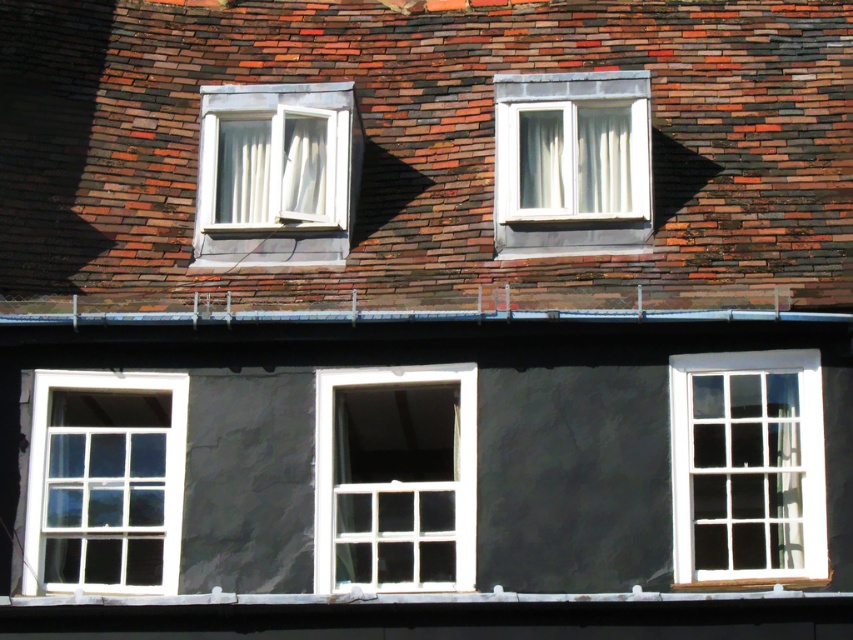
Is white wooden window at right smaller than white wood window at upper center?

No, white wooden window at right is not smaller than white wood window at upper center.

Can you confirm if white wooden window at right is positioned below white wood window at upper center?

Yes, white wooden window at right is below white wood window at upper center.

Does point (795, 416) come farther from viewer compared to point (572, 96)?

No, it is in front of (572, 96).

The width and height of the screenshot is (853, 640). I want to click on white wooden window at right, so [747, 467].

Does point (323, 202) come behind point (286, 179)?

Yes.

Is white plastic window at upper center wider than white sheer curtain at center?

Indeed, white plastic window at upper center has a greater width compared to white sheer curtain at center.

Which is behind, point (199, 152) or point (323, 154)?

The point (199, 152) is more distant.

At what (x,y) coordinates should I click in order to perform the action: click on white plastic window at upper center. Please return your answer as a coordinate pair (x, y). The image size is (853, 640). Looking at the image, I should click on (276, 173).

Between brown shingles at upper center and white sheer curtain at upper left, which one appears on the right side from the viewer's perspective?

Positioned to the right is brown shingles at upper center.

Is brown shingles at upper center smaller than white sheer curtain at upper left?

No, brown shingles at upper center is not smaller than white sheer curtain at upper left.

From the picture: Who is more forward, (177, 77) or (317, 168)?

Positioned in front is point (317, 168).

You are a GUI agent. You are given a task and a screenshot of the screen. Output one action in this format:
    pyautogui.click(x=<x>, y=<y>)
    Task: Click on the brown shingles at upper center
    
    Given the screenshot: What is the action you would take?
    pyautogui.click(x=428, y=152)